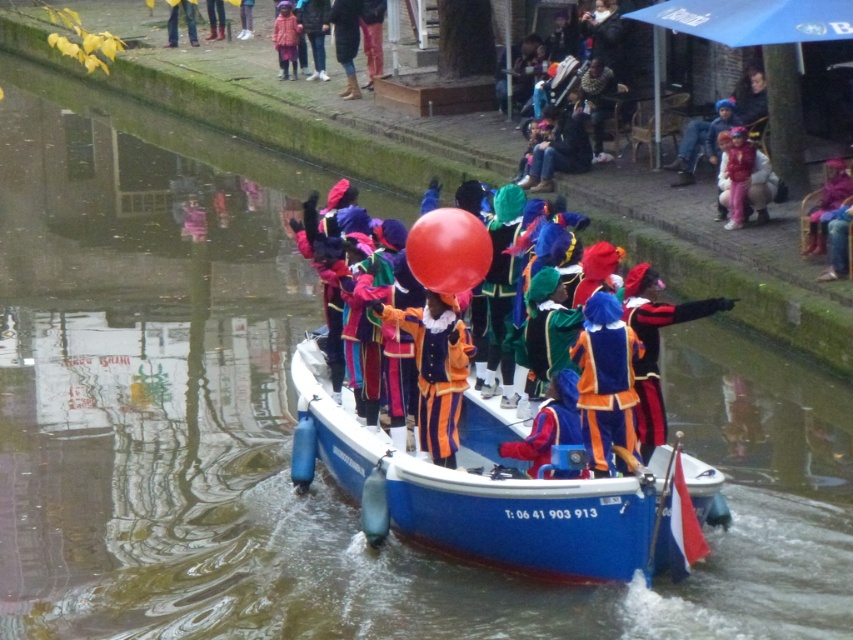
Is velvet orange costume at center bigger than pink fabric coat at upper center?

Correct, velvet orange costume at center is larger in size than pink fabric coat at upper center.

Is point (560, 305) positioned before point (296, 76)?

Yes, point (560, 305) is in front of point (296, 76).

You are a GUI agent. You are given a task and a screenshot of the screen. Output one action in this format:
    pyautogui.click(x=<x>, y=<y>)
    Task: Click on the velvet orange costume at center
    The image size is (853, 640).
    Given the screenshot: What is the action you would take?
    click(x=451, y=342)

Which is above, blue glossy boat at center or orange velvet costume at center?

orange velvet costume at center is higher up.

Is blue glossy boat at center thinner than orange velvet costume at center?

Incorrect, blue glossy boat at center's width is not less than orange velvet costume at center's.

Identify the location of blue glossy boat at center. (480, 490).

Does blue glossy boat at center have a larger size compared to rubber balloon at center?

Correct, blue glossy boat at center is larger in size than rubber balloon at center.

Is blue glossy boat at center to the left of rubber balloon at center from the viewer's perspective?

Yes, blue glossy boat at center is to the left of rubber balloon at center.

Describe the element at coordinates (480, 490) in the screenshot. I see `blue glossy boat at center` at that location.

Locate an element on the screen. blue glossy boat at center is located at coordinates pos(480,490).